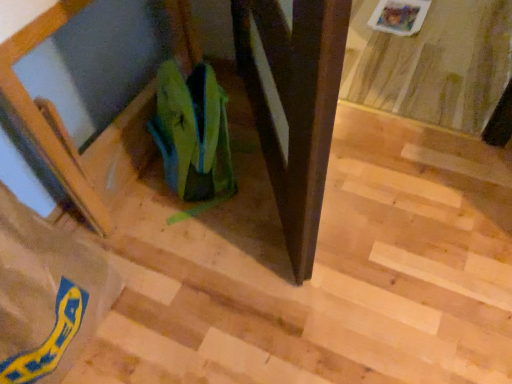
The height and width of the screenshot is (384, 512). What do you see at coordinates (46, 295) in the screenshot?
I see `brown paper bag at lower left, marked as the first grocery bag in a left-to-right arrangement` at bounding box center [46, 295].

Identify the location of brown paper bag at lower left, which appears as the 2th grocery bag when viewed from the right. The height and width of the screenshot is (384, 512). (46, 295).

Where is `green fabric bag at center, the 2th grocery bag viewed from the left`? The image size is (512, 384). green fabric bag at center, the 2th grocery bag viewed from the left is located at coordinates (192, 132).

What do you see at coordinates (192, 132) in the screenshot?
I see `green fabric bag at center, the 2th grocery bag viewed from the left` at bounding box center [192, 132].

The image size is (512, 384). Identify the location of brown paper bag at lower left, marked as the first grocery bag in a left-to-right arrangement. (46, 295).

Considering the relative positions of green fabric bag at center, the 2th grocery bag viewed from the left, and brown paper bag at lower left, which appears as the 2th grocery bag when viewed from the right, in the image provided, is green fabric bag at center, the 2th grocery bag viewed from the left, to the left of brown paper bag at lower left, which appears as the 2th grocery bag when viewed from the right, from the viewer's perspective?

Incorrect, green fabric bag at center, the 2th grocery bag viewed from the left, is not on the left side of brown paper bag at lower left, which appears as the 2th grocery bag when viewed from the right.

Between green fabric bag at center, arranged as the first grocery bag when viewed from the right, and brown paper bag at lower left, marked as the first grocery bag in a left-to-right arrangement, which one is positioned behind?

green fabric bag at center, arranged as the first grocery bag when viewed from the right, is more distant.

Does point (203, 196) appear closer or farther from the camera than point (31, 258)?

Point (203, 196) is positioned farther from the camera compared to point (31, 258).

From the image's perspective, between green fabric bag at center, arranged as the first grocery bag when viewed from the right, and brown paper bag at lower left, marked as the first grocery bag in a left-to-right arrangement, which one is located above?

green fabric bag at center, arranged as the first grocery bag when viewed from the right.

From a real-world perspective, who is located higher, green fabric bag at center, arranged as the first grocery bag when viewed from the right, or brown paper bag at lower left, marked as the first grocery bag in a left-to-right arrangement?

brown paper bag at lower left, marked as the first grocery bag in a left-to-right arrangement, is physically above.

Can you confirm if green fabric bag at center, the 2th grocery bag viewed from the left, is thinner than brown paper bag at lower left, which appears as the 2th grocery bag when viewed from the right?

Yes.

Between green fabric bag at center, the 2th grocery bag viewed from the left, and brown paper bag at lower left, which appears as the 2th grocery bag when viewed from the right, which one has more height?

With more height is brown paper bag at lower left, which appears as the 2th grocery bag when viewed from the right.

In terms of size, does green fabric bag at center, the 2th grocery bag viewed from the left, appear bigger or smaller than brown paper bag at lower left, marked as the first grocery bag in a left-to-right arrangement?

Considering their sizes, green fabric bag at center, the 2th grocery bag viewed from the left, takes up less space than brown paper bag at lower left, marked as the first grocery bag in a left-to-right arrangement.

Which is correct: green fabric bag at center, arranged as the first grocery bag when viewed from the right, is inside brown paper bag at lower left, marked as the first grocery bag in a left-to-right arrangement, or outside of it?

green fabric bag at center, arranged as the first grocery bag when viewed from the right, exists outside the volume of brown paper bag at lower left, marked as the first grocery bag in a left-to-right arrangement.

Is green fabric bag at center, the 2th grocery bag viewed from the left, positioned far away from brown paper bag at lower left, which appears as the 2th grocery bag when viewed from the right?

No.

Is green fabric bag at center, the 2th grocery bag viewed from the left, oriented away from brown paper bag at lower left, which appears as the 2th grocery bag when viewed from the right?

That's not correct — green fabric bag at center, the 2th grocery bag viewed from the left, is not looking away from brown paper bag at lower left, which appears as the 2th grocery bag when viewed from the right.

How far apart are green fabric bag at center, the 2th grocery bag viewed from the left, and brown paper bag at lower left, marked as the first grocery bag in a left-to-right arrangement?

They are 16.66 inches apart.

At what (x,y) coordinates should I click in order to perform the action: click on grocery bag that is on the left side of green fabric bag at center, the 2th grocery bag viewed from the left. Please return your answer as a coordinate pair (x, y). The width and height of the screenshot is (512, 384). Looking at the image, I should click on (46, 295).

Considering the positions of objects brown paper bag at lower left, which appears as the 2th grocery bag when viewed from the right, and green fabric bag at center, the 2th grocery bag viewed from the left, in the image provided, who is more to the left, brown paper bag at lower left, which appears as the 2th grocery bag when viewed from the right, or green fabric bag at center, the 2th grocery bag viewed from the left,?

Positioned to the left is brown paper bag at lower left, which appears as the 2th grocery bag when viewed from the right.

Considering the positions of objects brown paper bag at lower left, marked as the first grocery bag in a left-to-right arrangement, and green fabric bag at center, arranged as the first grocery bag when viewed from the right, in the image provided, who is in front, brown paper bag at lower left, marked as the first grocery bag in a left-to-right arrangement, or green fabric bag at center, arranged as the first grocery bag when viewed from the right,?

brown paper bag at lower left, marked as the first grocery bag in a left-to-right arrangement, is more forward.

Considering the points (5, 240) and (175, 118), which point is in front, point (5, 240) or point (175, 118)?

The point (5, 240) is closer to the camera.

From the image's perspective, is brown paper bag at lower left, which appears as the 2th grocery bag when viewed from the right, below green fabric bag at center, arranged as the first grocery bag when viewed from the right?

Yes.

Looking at this image, from a real-world perspective, is brown paper bag at lower left, which appears as the 2th grocery bag when viewed from the right, below green fabric bag at center, arranged as the first grocery bag when viewed from the right?

Incorrect, from a real-world perspective, brown paper bag at lower left, which appears as the 2th grocery bag when viewed from the right, is higher than green fabric bag at center, arranged as the first grocery bag when viewed from the right.

Between brown paper bag at lower left, which appears as the 2th grocery bag when viewed from the right, and green fabric bag at center, arranged as the first grocery bag when viewed from the right, which one has larger width?

With larger width is brown paper bag at lower left, which appears as the 2th grocery bag when viewed from the right.

Is brown paper bag at lower left, marked as the first grocery bag in a left-to-right arrangement, taller than green fabric bag at center, arranged as the first grocery bag when viewed from the right?

Yes.

Is brown paper bag at lower left, which appears as the 2th grocery bag when viewed from the right, bigger or smaller than green fabric bag at center, arranged as the first grocery bag when viewed from the right?

Clearly, brown paper bag at lower left, which appears as the 2th grocery bag when viewed from the right, is larger in size than green fabric bag at center, arranged as the first grocery bag when viewed from the right.

Choose the correct answer: Is brown paper bag at lower left, marked as the first grocery bag in a left-to-right arrangement, inside green fabric bag at center, arranged as the first grocery bag when viewed from the right, or outside it?

brown paper bag at lower left, marked as the first grocery bag in a left-to-right arrangement, is outside green fabric bag at center, arranged as the first grocery bag when viewed from the right.

Is there a large distance between brown paper bag at lower left, marked as the first grocery bag in a left-to-right arrangement, and green fabric bag at center, arranged as the first grocery bag when viewed from the right?

No, brown paper bag at lower left, marked as the first grocery bag in a left-to-right arrangement, is not far from green fabric bag at center, arranged as the first grocery bag when viewed from the right.

Is brown paper bag at lower left, which appears as the 2th grocery bag when viewed from the right, aimed at green fabric bag at center, arranged as the first grocery bag when viewed from the right?

No, brown paper bag at lower left, which appears as the 2th grocery bag when viewed from the right, is not turned towards green fabric bag at center, arranged as the first grocery bag when viewed from the right.

How distant is brown paper bag at lower left, marked as the first grocery bag in a left-to-right arrangement, from green fabric bag at center, arranged as the first grocery bag when viewed from the right?

brown paper bag at lower left, marked as the first grocery bag in a left-to-right arrangement, is 16.66 inches away from green fabric bag at center, arranged as the first grocery bag when viewed from the right.

Locate an element on the screen. grocery bag that appears above the green fabric bag at center, arranged as the first grocery bag when viewed from the right (from a real-world perspective) is located at coordinates (46, 295).

The height and width of the screenshot is (384, 512). Find the location of `grocery bag that appears on the left of green fabric bag at center, the 2th grocery bag viewed from the left`. grocery bag that appears on the left of green fabric bag at center, the 2th grocery bag viewed from the left is located at coordinates (46, 295).

At what (x,y) coordinates should I click in order to perform the action: click on grocery bag below the brown paper bag at lower left, marked as the first grocery bag in a left-to-right arrangement (from a real-world perspective). Please return your answer as a coordinate pair (x, y). Image resolution: width=512 pixels, height=384 pixels. Looking at the image, I should click on (192, 132).